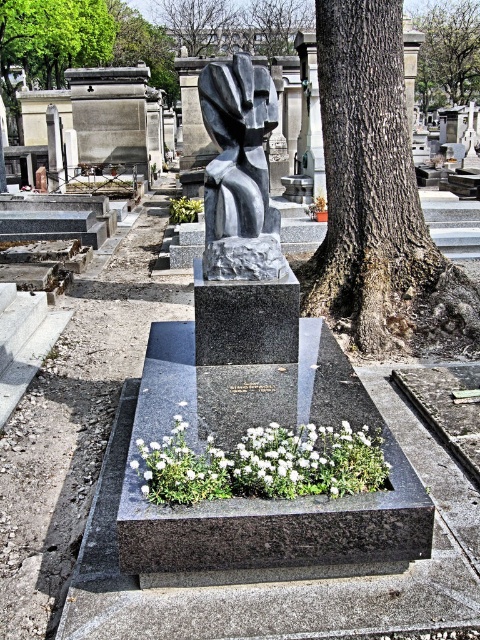
Can you confirm if slate gray stone sculpture at center is bigger than green leafy tree at center?

Indeed, slate gray stone sculpture at center has a larger size compared to green leafy tree at center.

Between point (267, 102) and point (439, 1), which one is positioned behind?

The point (439, 1) is behind.

The image size is (480, 640). What are the coordinates of `slate gray stone sculpture at center` in the screenshot? It's located at (239, 172).

Is slate gray stone sculpture at center thinner than green leafy tree at upper center?

Yes.

Does point (260, 275) lie behind point (19, 33)?

No, it is not.

Where is `slate gray stone sculpture at center`? The height and width of the screenshot is (640, 480). slate gray stone sculpture at center is located at coordinates (239, 172).

Does green leafy tree at center appear under brown textured tree trunk at upper center?

Yes.

Which is above, green leafy tree at center or brown textured tree trunk at upper center?

brown textured tree trunk at upper center is above.

The image size is (480, 640). Describe the element at coordinates (447, 52) in the screenshot. I see `green leafy tree at center` at that location.

The width and height of the screenshot is (480, 640). Find the location of `green leafy tree at center`. green leafy tree at center is located at coordinates (447, 52).